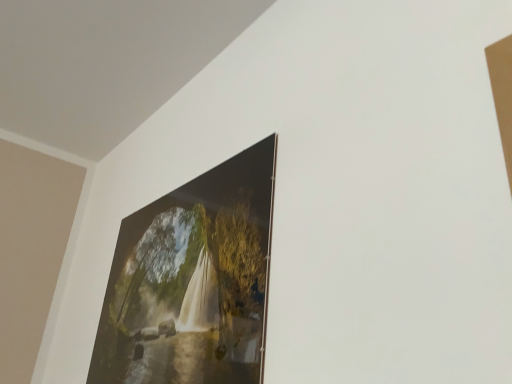
Question: In which direction should I rotate to look at metallic glossy picture frame at upper center?

Choices:
 (A) left
 (B) right

Answer: (A)